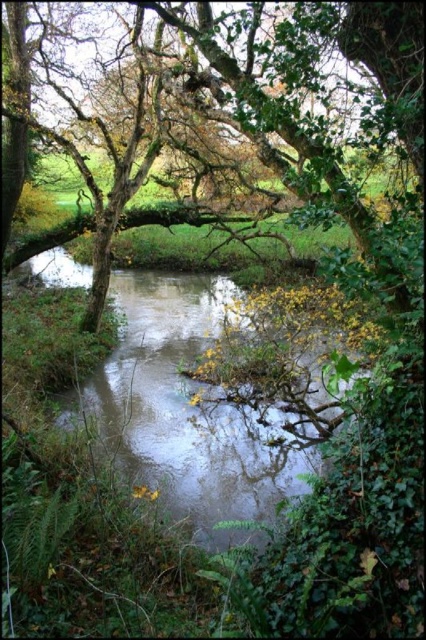
You are standing at the origin point in the scene. Which direction should you move to reach the clear water at center?

The clear water at center is located at coordinates point 0.641 on the x axis and 0.444 on the y axis, so you should move to the right and forward to reach it.

You are a hiker who wants to cross the stream using a fallen log. You see the clear water at center and the green leafy tree at center. Which object is directly above the other?

The green leafy tree at center is directly above the clear water at center because the clear water at center is positioned under the green leafy tree at center.